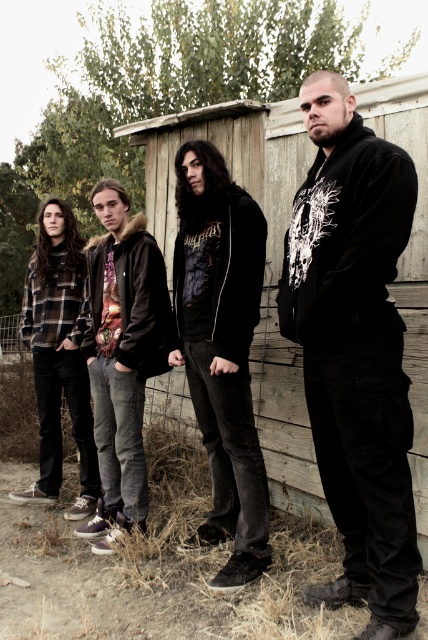
Who is shorter, black velvety hoodie at center or dark gray hoodie at center?

dark gray hoodie at center

Is point (392, 570) behind point (198, 260)?

No, it is not.

In order to click on black velvety hoodie at center in this screenshot , I will do `click(354, 349)`.